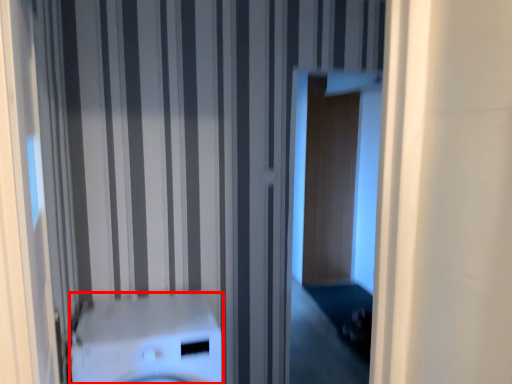
Question: From the image's perspective, what is the correct spatial positioning of washer (annotated by the red box) in reference to screen door?

Choices:
 (A) above
 (B) below

Answer: (B)